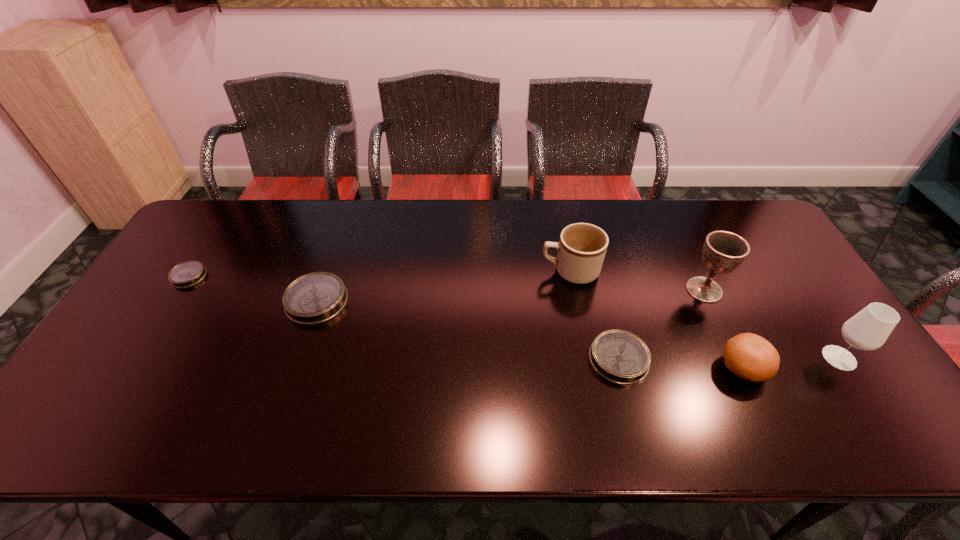
Locate an element on the screen. The height and width of the screenshot is (540, 960). the sixth closest object to the sixth tallest object is located at coordinates (186, 274).

Select which object is the sixth closest to the fourth tallest object. Please provide its 2D coordinates. Your answer should be formatted as a tuple, i.e. [(x, y)], where the tuple contains the x and y coordinates of a point satisfying the conditions above.

[(186, 274)]

Find the location of `compass object that ranks as the third closest to the chalice`. compass object that ranks as the third closest to the chalice is located at coordinates (186, 274).

Choose which compass is the nearest neighbor to the mug. Please provide its 2D coordinates. Your answer should be formatted as a tuple, i.e. [(x, y)], where the tuple contains the x and y coordinates of a point satisfying the conditions above.

[(619, 356)]

Locate an element on the screen. The image size is (960, 540). vacant space that satisfies the following two spatial constraints: 1. on the back side of the second compass from right to left; 2. on the side of the mug with the handle is located at coordinates (326, 271).

Where is `free space that satisfies the following two spatial constraints: 1. on the front side of the second object from left to right; 2. on the right side of the shortest object`? This screenshot has width=960, height=540. free space that satisfies the following two spatial constraints: 1. on the front side of the second object from left to right; 2. on the right side of the shortest object is located at coordinates (173, 301).

In order to click on vacant space that satisfies the following two spatial constraints: 1. on the front side of the second object from left to right; 2. on the right side of the fourth shortest object in this screenshot , I will do (x=294, y=368).

Where is `free point that satisfies the following two spatial constraints: 1. on the front side of the shortest object; 2. on the right side of the second shortest compass`? The width and height of the screenshot is (960, 540). free point that satisfies the following two spatial constraints: 1. on the front side of the shortest object; 2. on the right side of the second shortest compass is located at coordinates coord(136,359).